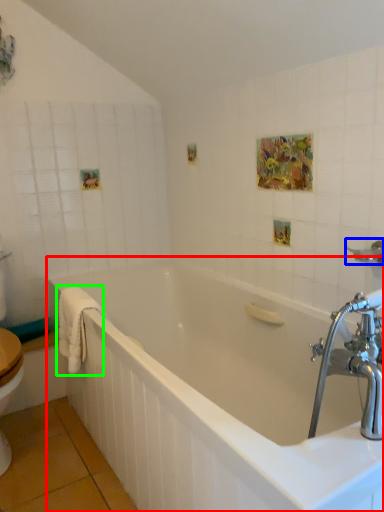
Question: Which object is positioned closest to bathtub (highlighted by a red box)? Select from shower (highlighted by a blue box) and bath towel (highlighted by a green box).

Choices:
 (A) shower
 (B) bath towel

Answer: (B)